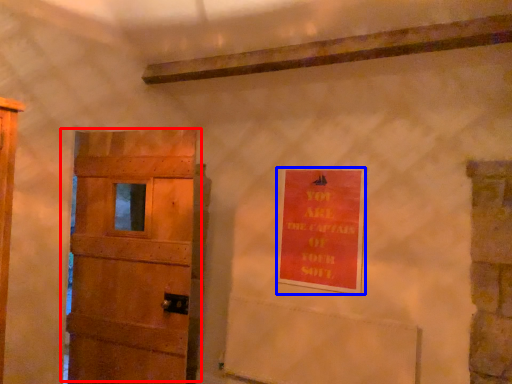
Question: Which point is closer to the camera, door (highlighted by a red box) or warning sign (highlighted by a blue box)?

Choices:
 (A) door
 (B) warning sign

Answer: (A)